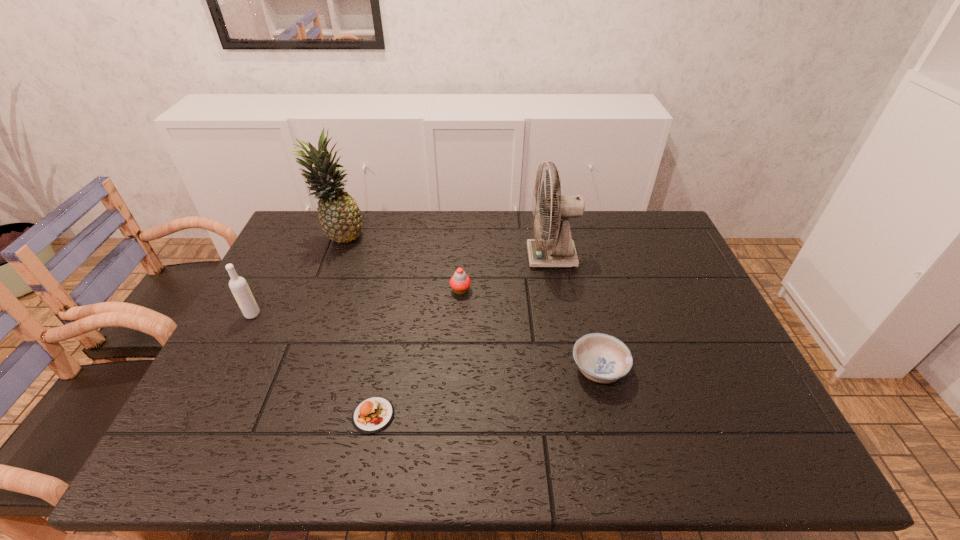
This screenshot has width=960, height=540. Identify the location of object at the near edge. (373, 414).

In order to click on pineapple located in the left edge section of the desktop in this screenshot , I will do `click(339, 215)`.

Where is `vodka located at the left edge`? This screenshot has width=960, height=540. vodka located at the left edge is located at coordinates (238, 285).

Locate an element on the screen. The image size is (960, 540). object that is at the far left corner is located at coordinates (x=339, y=215).

Where is `free space at the far edge`? The width and height of the screenshot is (960, 540). free space at the far edge is located at coordinates (383, 226).

Locate an element on the screen. The height and width of the screenshot is (540, 960). vacant space at the near edge is located at coordinates (252, 448).

I want to click on free space at the left edge of the desktop, so click(x=300, y=315).

In the image, there is a desktop. Where is `vacant space at the right edge`? This screenshot has width=960, height=540. vacant space at the right edge is located at coordinates (660, 319).

I want to click on free location at the near left corner, so click(x=220, y=428).

This screenshot has height=540, width=960. I want to click on free space between the vodka and the fourth tallest object, so click(356, 302).